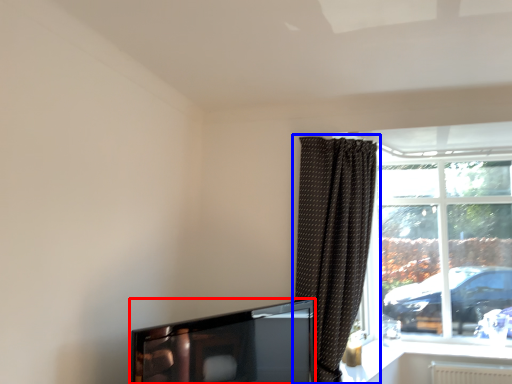
Question: Which object is further to the camera taking this photo, television (highlighted by a red box) or curtain (highlighted by a blue box)?

Choices:
 (A) television
 (B) curtain

Answer: (B)